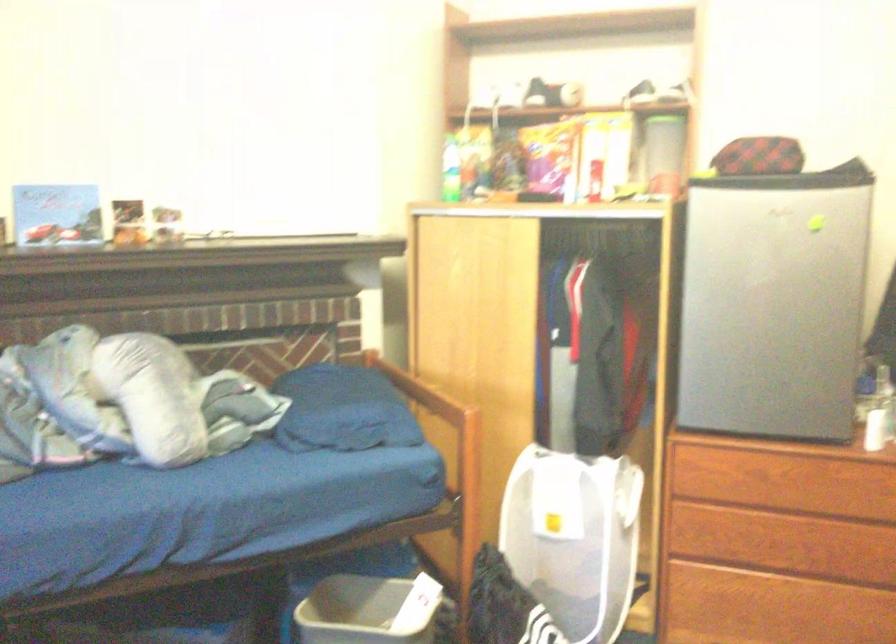
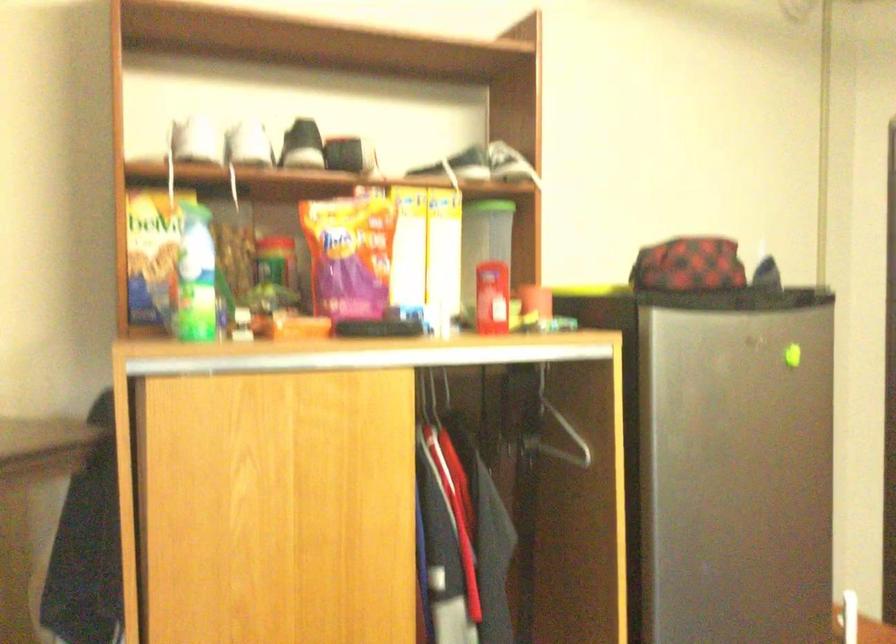
Locate, in the second image, the point that corresponds to (544,154) in the first image.

(349, 254)